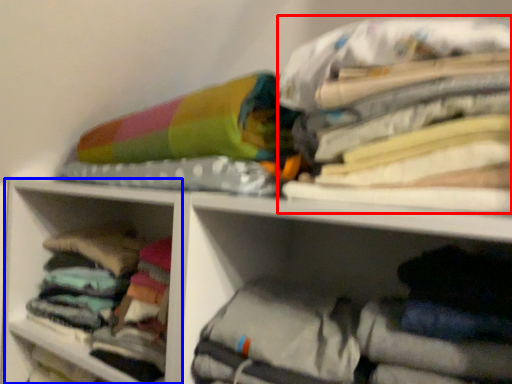
Question: Which object is closer to the camera taking this photo, clothing (highlighted by a red box) or cabinet (highlighted by a blue box)?

Choices:
 (A) clothing
 (B) cabinet

Answer: (A)